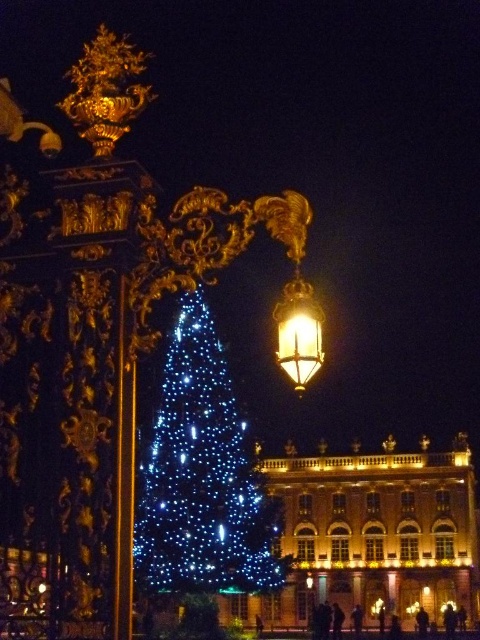
Is gold metallic lantern at upper center thinner than gold polished metal street light at center?

Incorrect, gold metallic lantern at upper center's width is not less than gold polished metal street light at center's.

Can you confirm if gold metallic lantern at upper center is bigger than gold polished metal street light at center?

Correct, gold metallic lantern at upper center is larger in size than gold polished metal street light at center.

From the picture: Who is more forward, (300, 385) or (313, 586)?

Positioned in front is point (300, 385).

The image size is (480, 640). I want to click on gold metallic lantern at upper center, so click(x=299, y=332).

Does illuminated plastic christmas tree at center appear on the right side of gold polished metal street light at center?

Incorrect, illuminated plastic christmas tree at center is not on the right side of gold polished metal street light at center.

Locate an element on the screen. The image size is (480, 640). illuminated plastic christmas tree at center is located at coordinates tap(203, 476).

Does illuminated plastic christmas tree at center appear on the right side of gold metallic lantern at upper center?

No, illuminated plastic christmas tree at center is not to the right of gold metallic lantern at upper center.

Is point (149, 497) positioned after point (312, 324)?

Yes.

The height and width of the screenshot is (640, 480). Identify the location of illuminated plastic christmas tree at center. (203, 476).